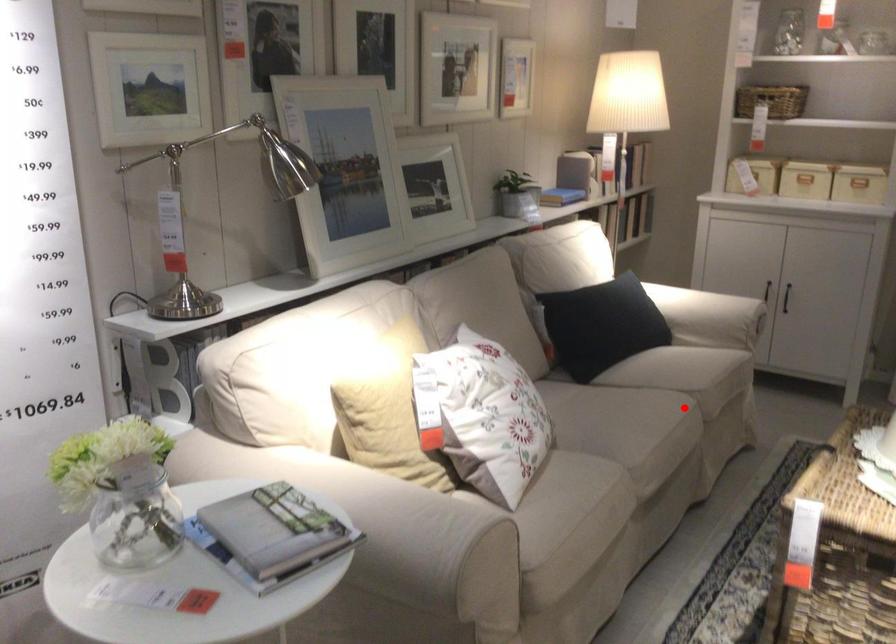
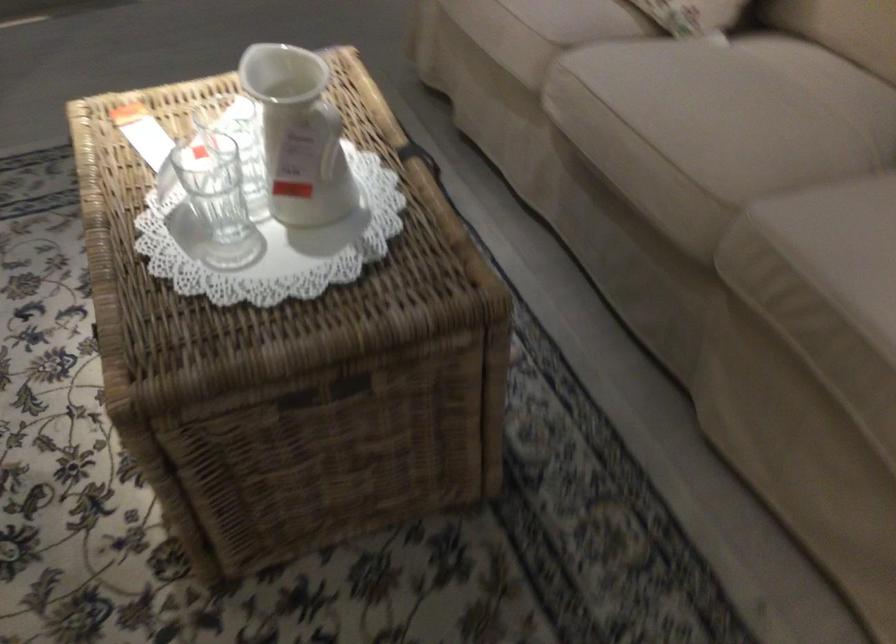
Question: I am providing you with two images of the same scene from different viewpoints. A red point is marked on the first image. Can you still see the location of the red point in image 2?

Choices:
 (A) Yes
 (B) No

Answer: (A)